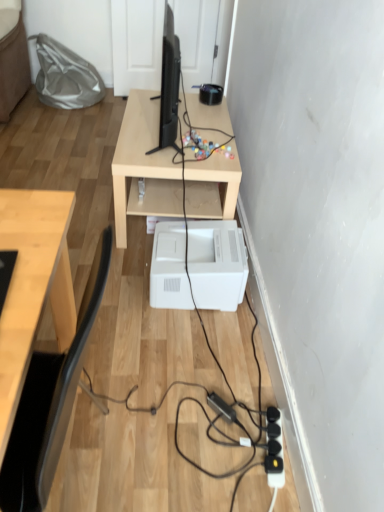
Question: From the image's perspective, would you say white plastic printer at lower center is positioned over black plastic extension cord at lower right?

Choices:
 (A) yes
 (B) no

Answer: (A)

Question: Is white plastic printer at lower center positioned before black plastic extension cord at lower right?

Choices:
 (A) no
 (B) yes

Answer: (A)

Question: From the image's perspective, is white plastic printer at lower center below black plastic extension cord at lower right?

Choices:
 (A) no
 (B) yes

Answer: (A)

Question: Does white plastic printer at lower center have a greater width compared to black plastic extension cord at lower right?

Choices:
 (A) yes
 (B) no

Answer: (A)

Question: From a real-world perspective, is white plastic printer at lower center on top of black plastic extension cord at lower right?

Choices:
 (A) yes
 (B) no

Answer: (A)

Question: Considering the relative sizes of white plastic printer at lower center and black plastic extension cord at lower right in the image provided, is white plastic printer at lower center thinner than black plastic extension cord at lower right?

Choices:
 (A) yes
 (B) no

Answer: (B)

Question: Can you confirm if light wood table at center is positioned to the right of black plastic extension cord at lower right?

Choices:
 (A) yes
 (B) no

Answer: (B)

Question: Is light wood table at center taller than black plastic extension cord at lower right?

Choices:
 (A) yes
 (B) no

Answer: (A)

Question: Is light wood table at center aimed at black plastic extension cord at lower right?

Choices:
 (A) no
 (B) yes

Answer: (A)

Question: Is the position of light wood table at center more distant than that of black plastic extension cord at lower right?

Choices:
 (A) no
 (B) yes

Answer: (B)

Question: Can you confirm if light wood table at center is thinner than black plastic extension cord at lower right?

Choices:
 (A) yes
 (B) no

Answer: (B)

Question: From the image's perspective, is light wood table at center below black plastic extension cord at lower right?

Choices:
 (A) yes
 (B) no

Answer: (B)

Question: Is white plastic printer at lower center located within black matte desktop computer at center?

Choices:
 (A) no
 (B) yes

Answer: (A)